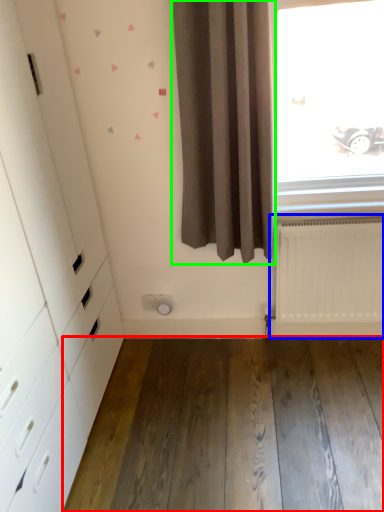
Question: Which object is the closest to the hardwood (highlighted by a red box)? Choose among these: radiator (highlighted by a blue box) or curtain (highlighted by a green box).

Choices:
 (A) radiator
 (B) curtain

Answer: (A)